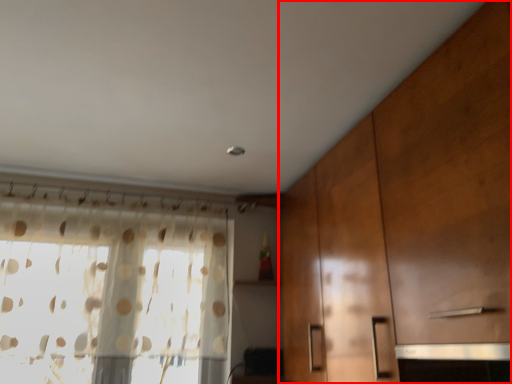
Question: Considering the relative positions of cabinetry (annotated by the red box) and window in the image provided, where is cabinetry (annotated by the red box) located with respect to the staircase?

Choices:
 (A) left
 (B) right

Answer: (B)